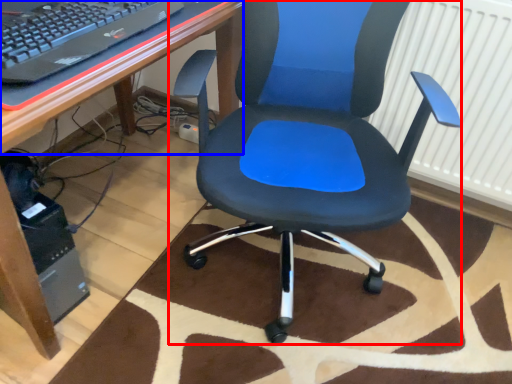
Question: Which of the following is the closest to the observer, chair (highlighted by a red box) or computer desk (highlighted by a blue box)?

Choices:
 (A) chair
 (B) computer desk

Answer: (A)